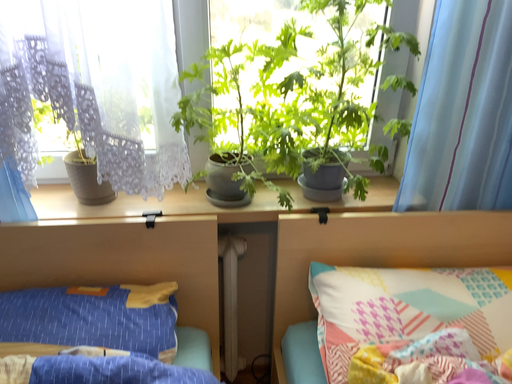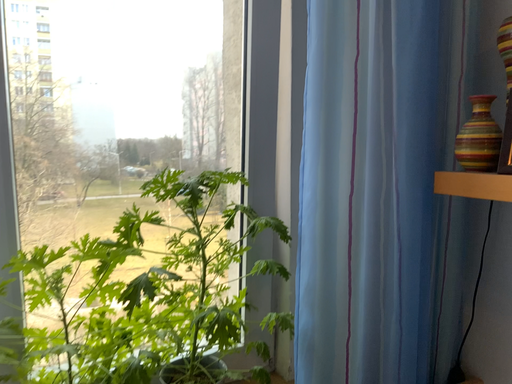
Question: How did the camera likely rotate when shooting the video?

Choices:
 (A) rotated right
 (B) rotated left

Answer: (A)